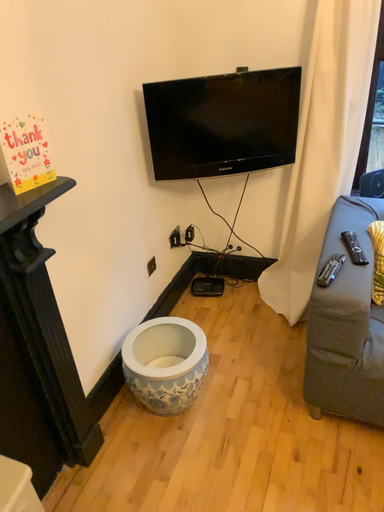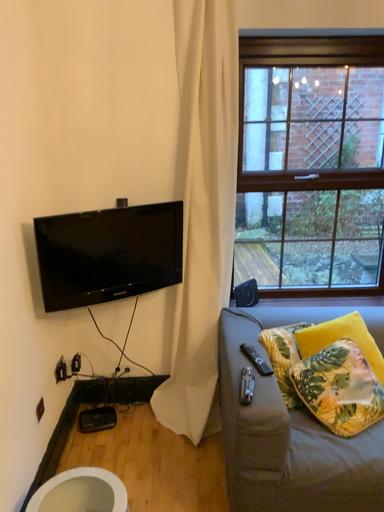
Question: How did the camera likely rotate when shooting the video?

Choices:
 (A) rotated right
 (B) rotated left

Answer: (A)